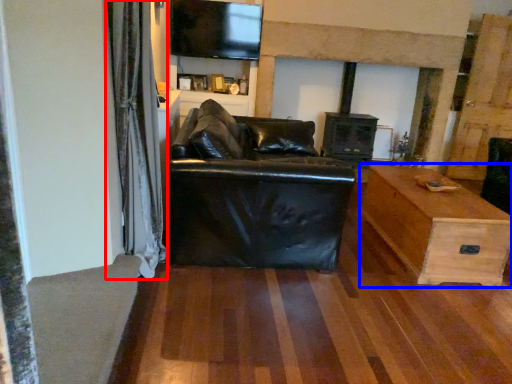
Question: Which point is closer to the camera, curtain (highlighted by a red box) or table (highlighted by a blue box)?

Choices:
 (A) curtain
 (B) table

Answer: (A)